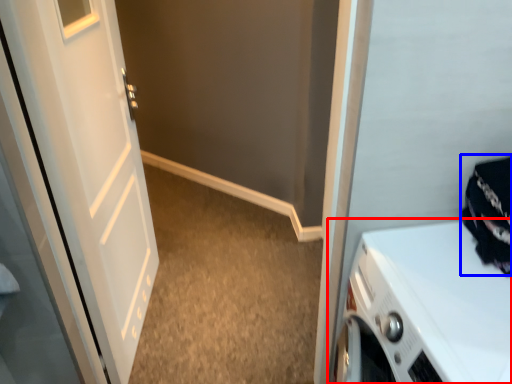
Question: Which point is further to the camera, home appliance (highlighted by a red box) or clothing (highlighted by a blue box)?

Choices:
 (A) home appliance
 (B) clothing

Answer: (B)